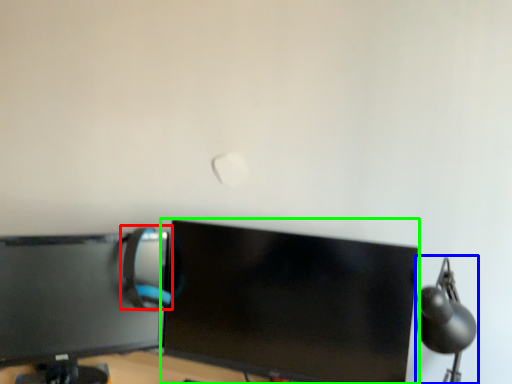
Question: Considering the real-world distances, which object is farthest from computer chair (highlighted by a red box)? table lamp (highlighted by a blue box) or computer monitor (highlighted by a green box)?

Choices:
 (A) table lamp
 (B) computer monitor

Answer: (A)